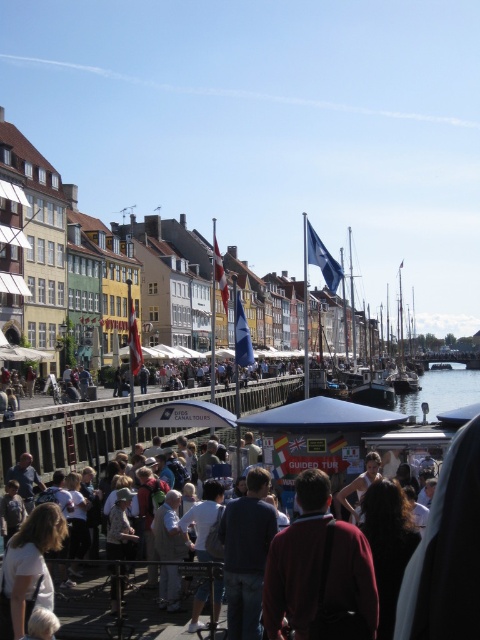
Does dark blue shirt at center have a lesser width compared to light gray fabric jacket at center?

Incorrect, dark blue shirt at center's width is not less than light gray fabric jacket at center's.

Does dark blue shirt at center have a greater width compared to light gray fabric jacket at center?

Correct, the width of dark blue shirt at center exceeds that of light gray fabric jacket at center.

Where is `dark blue shirt at center`? dark blue shirt at center is located at coordinates (247, 554).

Does point (204, 500) come in front of point (179, 557)?

No, (204, 500) is further to viewer.

What are the coordinates of `white cotton shirt at center` in the screenshot? It's located at (203, 516).

Which is in front, point (260, 490) or point (350, 518)?

Positioned in front is point (260, 490).

Is dark blue shirt at center above matte black dress at center?

Incorrect, dark blue shirt at center is not positioned above matte black dress at center.

This screenshot has height=640, width=480. I want to click on dark blue shirt at center, so click(x=247, y=554).